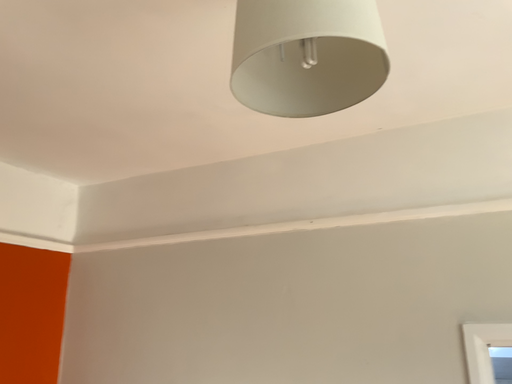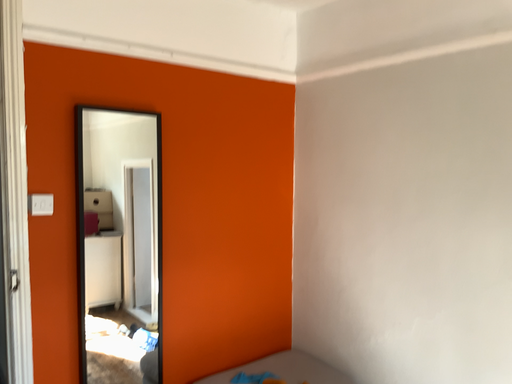
Question: Which way did the camera rotate in the video?

Choices:
 (A) rotated downward
 (B) rotated upward

Answer: (A)